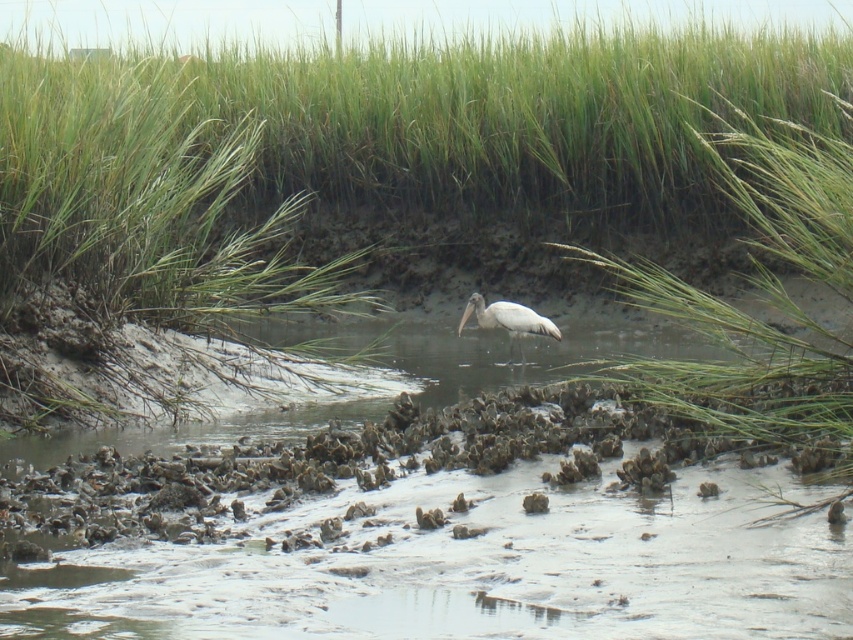
Does green grass at center have a greater height compared to white smooth stork at center?

Indeed, green grass at center has a greater height compared to white smooth stork at center.

Does green grass at center appear on the left side of white smooth stork at center?

Yes, green grass at center is to the left of white smooth stork at center.

In order to click on green grass at center in this screenshot , I will do `click(367, 145)`.

Identify the location of green grass at center. The width and height of the screenshot is (853, 640). click(367, 145).